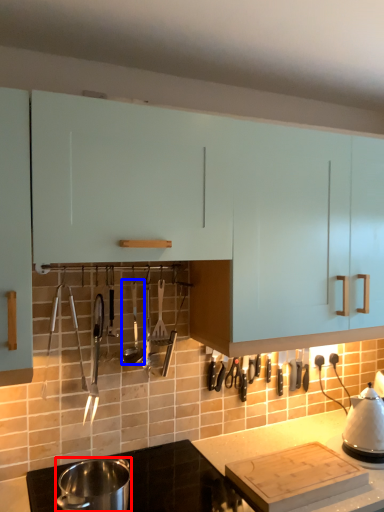
Question: Which of the following is the closest to the observer, kitchen appliance (highlighted by a red box) or silverware (highlighted by a blue box)?

Choices:
 (A) kitchen appliance
 (B) silverware

Answer: (A)